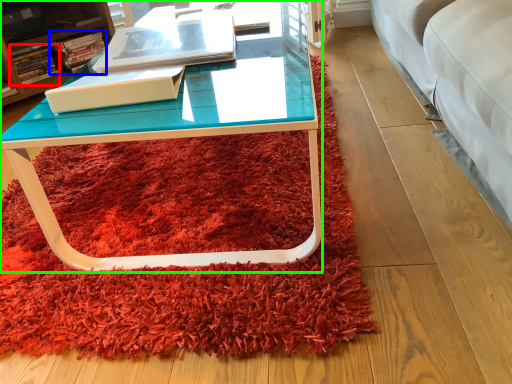
Question: Considering the real-world distances, which object is closest to book (highlighted by a red box)? book (highlighted by a blue box) or coffee table (highlighted by a green box).

Choices:
 (A) book
 (B) coffee table

Answer: (A)